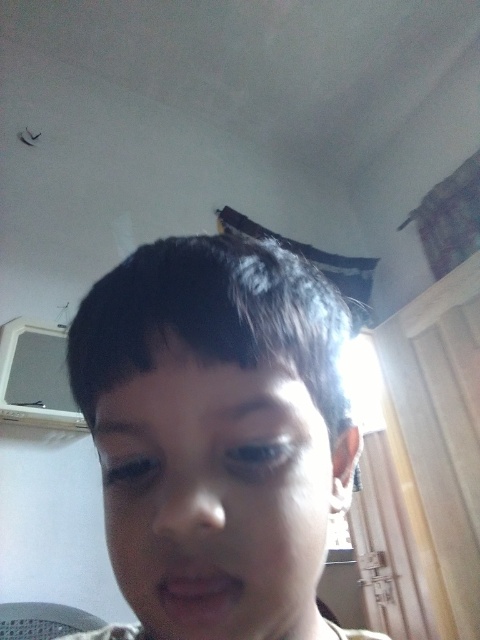
Is smooth skin face at center positioned before dark brown hair at upper left?

Yes, smooth skin face at center is closer to the viewer.

Can you confirm if smooth skin face at center is taller than dark brown hair at upper left?

Correct, smooth skin face at center is much taller as dark brown hair at upper left.

Is point (226, 442) positioned before point (111, 426)?

Yes, point (226, 442) is closer to viewer.

The width and height of the screenshot is (480, 640). Find the location of `smooth skin face at center`. smooth skin face at center is located at coordinates (216, 500).

Does point (249, 406) lie in front of point (132, 426)?

Yes, point (249, 406) is in front of point (132, 426).

Is dark brown hair at upper center shorter than dark brown hair at upper left?

Indeed, dark brown hair at upper center has a lesser height compared to dark brown hair at upper left.

Identify the location of dark brown hair at upper center. (250, 406).

In the scene shown: Is smooth skin face at center below dark brown hair at upper center?

Yes, smooth skin face at center is below dark brown hair at upper center.

Can you confirm if smooth skin face at center is wider than dark brown hair at upper center?

Yes, smooth skin face at center is wider than dark brown hair at upper center.

In the scene shown: Who is more distant from viewer, (137, 564) or (226, 406)?

The point (137, 564) is more distant.

Find the location of a particular element. smooth skin face at center is located at coordinates tap(216, 500).